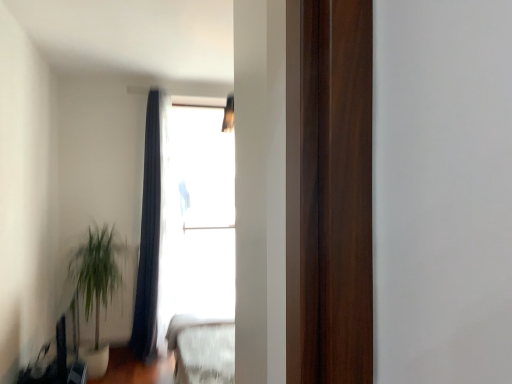
Question: From the image's perspective, is transparent glass window at upper center under green leafy plant at lower left?

Choices:
 (A) yes
 (B) no

Answer: (B)

Question: Are transparent glass window at upper center and green leafy plant at lower left located far from each other?

Choices:
 (A) no
 (B) yes

Answer: (B)

Question: Does transparent glass window at upper center have a larger size compared to green leafy plant at lower left?

Choices:
 (A) yes
 (B) no

Answer: (B)

Question: Is transparent glass window at upper center thinner than green leafy plant at lower left?

Choices:
 (A) yes
 (B) no

Answer: (A)

Question: Is transparent glass window at upper center at the right side of green leafy plant at lower left?

Choices:
 (A) yes
 (B) no

Answer: (A)

Question: Considering the positions of point (108, 240) and point (151, 160), is point (108, 240) closer or farther from the camera than point (151, 160)?

Choices:
 (A) closer
 (B) farther

Answer: (A)

Question: Looking at the image, does green leafy plant at lower left seem bigger or smaller compared to dark blue fabric curtain at upper center?

Choices:
 (A) small
 (B) big

Answer: (B)

Question: Considering the positions of green leafy plant at lower left and dark blue fabric curtain at upper center in the image, is green leafy plant at lower left wider or thinner than dark blue fabric curtain at upper center?

Choices:
 (A) wide
 (B) thin

Answer: (A)

Question: From a real-world perspective, relative to dark blue fabric curtain at upper center, is green leafy plant at lower left vertically above or below?

Choices:
 (A) above
 (B) below

Answer: (B)

Question: From the image's perspective, relative to green leafy plant at lower left, is transparent glass window at upper center above or below?

Choices:
 (A) above
 (B) below

Answer: (A)

Question: Is transparent glass window at upper center to the left or to the right of green leafy plant at lower left in the image?

Choices:
 (A) right
 (B) left

Answer: (A)

Question: Does point (205, 221) appear closer or farther from the camera than point (98, 246)?

Choices:
 (A) farther
 (B) closer

Answer: (A)

Question: From a real-world perspective, relative to green leafy plant at lower left, is transparent glass window at upper center vertically above or below?

Choices:
 (A) below
 (B) above

Answer: (B)

Question: From the image's perspective, is dark blue fabric curtain at upper center above or below green leafy plant at lower left?

Choices:
 (A) below
 (B) above

Answer: (B)

Question: From a real-world perspective, is dark blue fabric curtain at upper center above or below green leafy plant at lower left?

Choices:
 (A) below
 (B) above

Answer: (B)